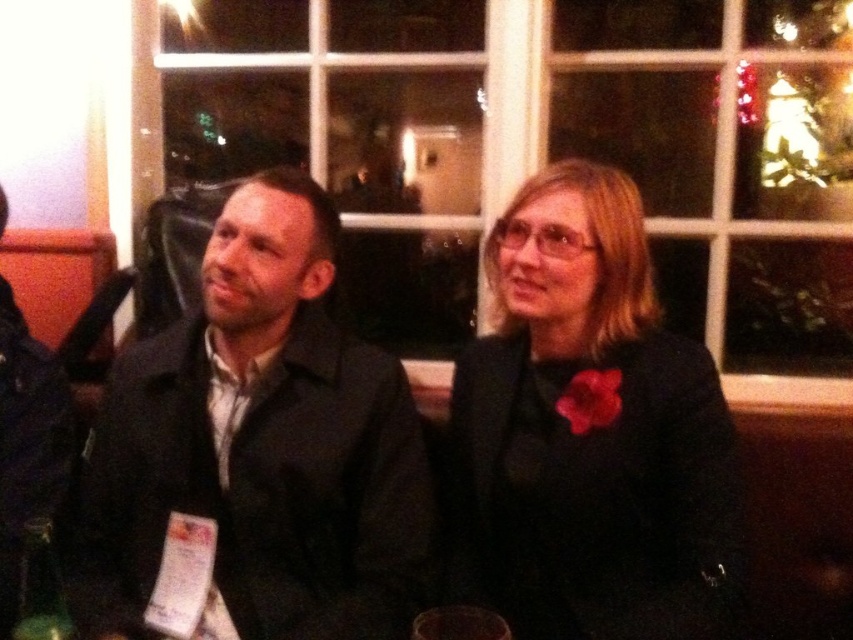
You are standing in front of the image and want to locate the matte black jacket at left. What are its coordinates?

The coordinates of the matte black jacket at left are at point [262,444].